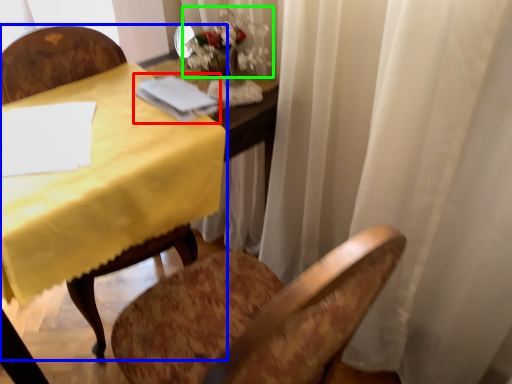
Question: Based on their relative distances, which object is nearer to notebook (highlighted by a red box)? Choose from chair (highlighted by a blue box) and floral arrangement (highlighted by a green box).

Choices:
 (A) chair
 (B) floral arrangement

Answer: (B)